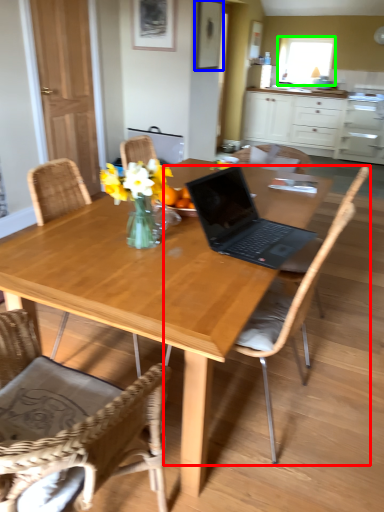
Question: Which object is the closest to the chair (highlighted by a red box)? Choose among these: picture frame (highlighted by a blue box) or window screen (highlighted by a green box).

Choices:
 (A) picture frame
 (B) window screen

Answer: (A)